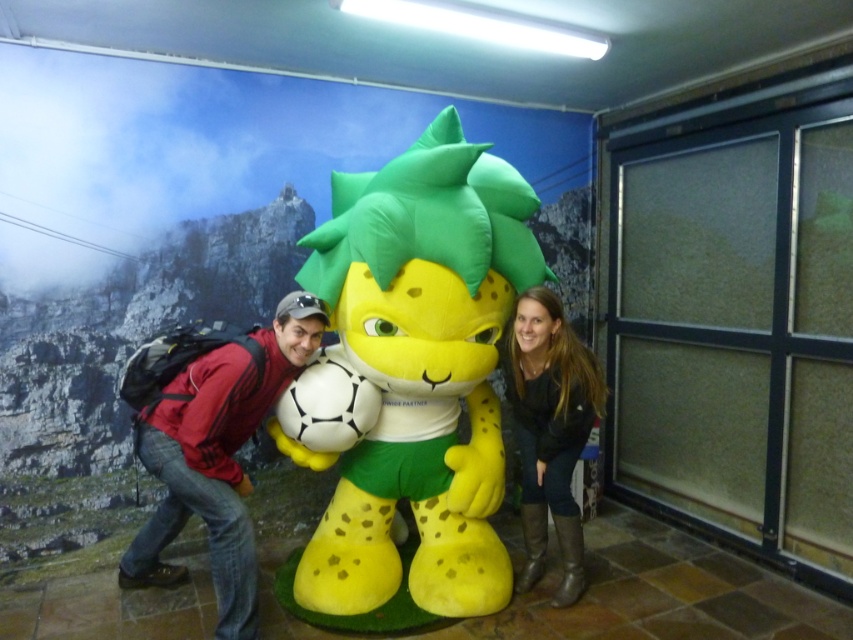
You are a photographer setting up a tripod to take a group photo. You notice the red fleece jacket at left and the dark brown leather boots at lower right. Which object should you adjust your camera angle to include in the frame first if you want to ensure both are fully visible?

You should adjust your camera angle to include the red fleece jacket at left first because it is shorter than the dark brown leather boots at lower right, so it might be partially hidden if the angle is too low.

You are a photographer adjusting the camera settings to focus on both the red fleece jacket at left and the dark brown leather boots at lower right. Which object should you focus on first to ensure both are in sharp focus?

You should focus on the red fleece jacket at left first because it is closer to the viewer than the dark brown leather boots at lower right, allowing the depth of field to cover both objects.